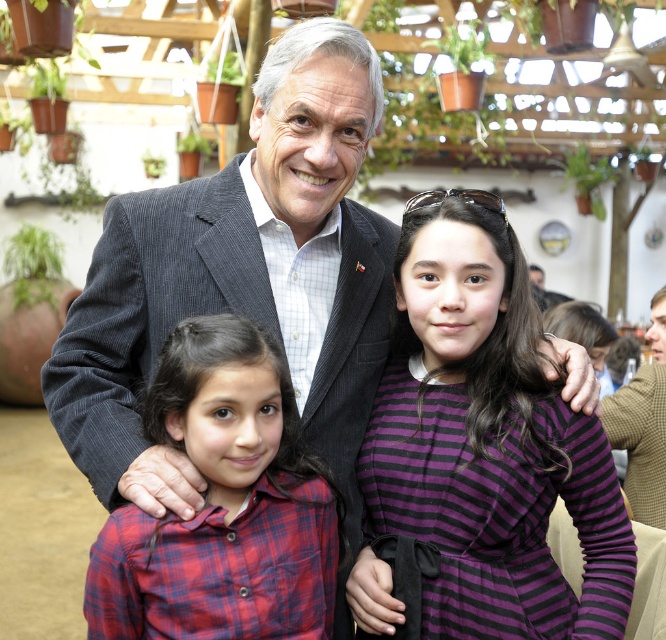
Is dark gray corduroy suit at center smaller than plaid fabric shirt at lower left?

No.

Does point (360, 54) come closer to viewer compared to point (336, 540)?

No, (360, 54) is behind (336, 540).

What do you see at coordinates (240, 276) in the screenshot? Image resolution: width=666 pixels, height=640 pixels. I see `dark gray corduroy suit at center` at bounding box center [240, 276].

The image size is (666, 640). Identify the location of dark gray corduroy suit at center. (240, 276).

Does purple striped dress at center lie in front of plaid fabric shirt at lower left?

No.

Which is in front, point (370, 525) or point (224, 432)?

Point (224, 432)

I want to click on purple striped dress at center, so click(488, 442).

This screenshot has height=640, width=666. I want to click on purple striped dress at center, so click(488, 442).

Can you confirm if dark gray corduroy suit at center is bigger than purple striped dress at center?

Indeed, dark gray corduroy suit at center has a larger size compared to purple striped dress at center.

Who is lower down, dark gray corduroy suit at center or purple striped dress at center?

Positioned lower is purple striped dress at center.

Which is in front, point (308, 344) or point (444, 218)?

Point (444, 218) is in front.

The height and width of the screenshot is (640, 666). Identify the location of dark gray corduroy suit at center. (240, 276).